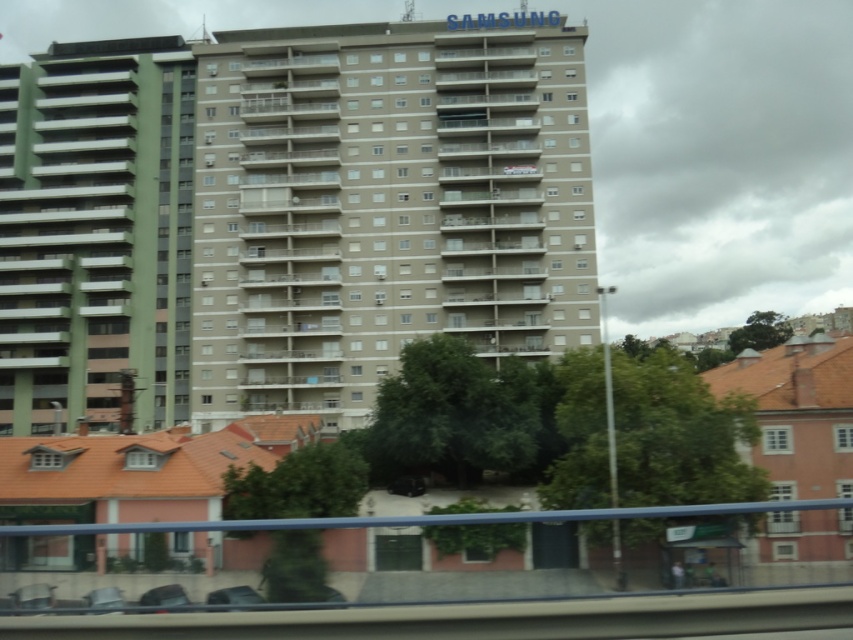
Is point (277, 380) closer to viewer compared to point (218, 595)?

No, (277, 380) is behind (218, 595).

Between point (328, 385) and point (252, 600), which one is positioned in front?

Positioned in front is point (252, 600).

Find the location of a particular element. The height and width of the screenshot is (640, 853). beige concrete building at center is located at coordinates (386, 205).

Can you confirm if beige concrete building at center is positioned below green matte building at left?

Actually, beige concrete building at center is above green matte building at left.

Does beige concrete building at center have a greater width compared to green matte building at left?

Indeed, beige concrete building at center has a greater width compared to green matte building at left.

Is point (585, 252) behind point (115, 300)?

No.

Locate an element on the screen. The width and height of the screenshot is (853, 640). beige concrete building at center is located at coordinates (386, 205).

Does green matte building at left have a lesser width compared to metallic gray car at lower center?

Incorrect, green matte building at left's width is not less than metallic gray car at lower center's.

What do you see at coordinates (96, 234) in the screenshot? I see `green matte building at left` at bounding box center [96, 234].

Is point (131, 352) less distant than point (218, 589)?

No, (131, 352) is behind (218, 589).

Where is `green matte building at left`? The width and height of the screenshot is (853, 640). green matte building at left is located at coordinates (96, 234).